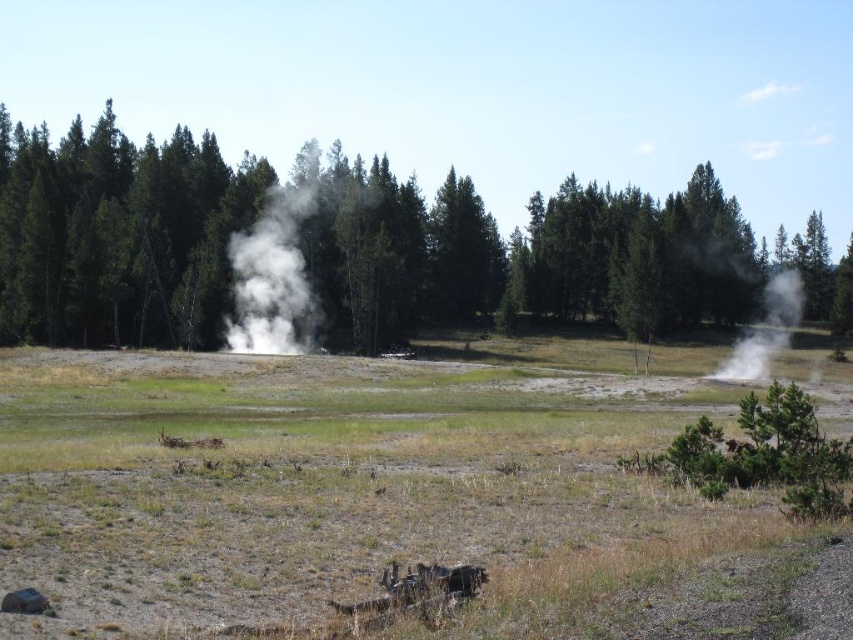
Question: Considering the real-world distances, which object is closest to the green grassy field at center?

Choices:
 (A) white vapor at center
 (B) white vapor steam at right
 (C) green matte tree at center

Answer: (B)

Question: Does green grassy field at center appear on the right side of white vapor steam at right?

Choices:
 (A) yes
 (B) no

Answer: (B)

Question: Is green grassy field at center to the right of white vapor at center from the viewer's perspective?

Choices:
 (A) no
 (B) yes

Answer: (B)

Question: Which of the following is the closest to the observer?

Choices:
 (A) white vapor at center
 (B) green grassy field at center
 (C) white vapor steam at right

Answer: (B)

Question: Is green grassy field at center further to the viewer compared to white vapor at center?

Choices:
 (A) yes
 (B) no

Answer: (B)

Question: Which point is farther from the camera taking this photo?

Choices:
 (A) (337, 481)
 (B) (744, 330)

Answer: (B)